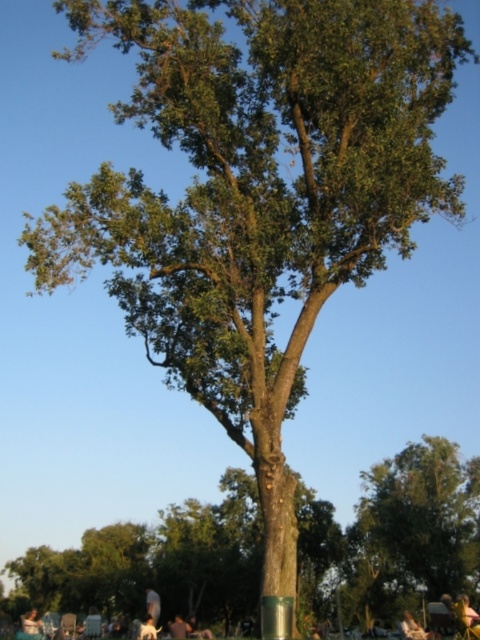
Question: Which of the following is the farthest from the observer?

Choices:
 (A) (39, 620)
 (B) (157, 616)
 (C) (149, 614)

Answer: (A)

Question: Is green rough bark tree at center closer to the viewer compared to light brown wooden chair at lower left?

Choices:
 (A) yes
 (B) no

Answer: (B)

Question: Which object is the closest to the light brown fabric shirt at lower center?

Choices:
 (A) green rough bark tree at center
 (B) light brown wooden chair at lower left
 (C) white fur dog at lower center
 (D) dark gray fabric shirt at lower center

Answer: (D)

Question: Does light brown fabric shirt at lower center appear on the left side of white fur dog at lower center?

Choices:
 (A) no
 (B) yes

Answer: (B)

Question: Among these objects, which one is nearest to the camera?

Choices:
 (A) green rough bark tree at center
 (B) light brown wooden chair at lower left

Answer: (B)

Question: Does green rough bark tree at center appear under light brown wooden chair at lower left?

Choices:
 (A) yes
 (B) no

Answer: (B)